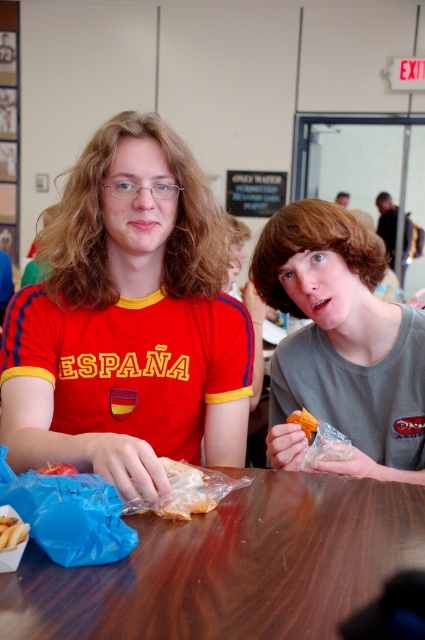
Does wooden table at center lie behind matte gray shirt at center?

No.

Can you confirm if wooden table at center is positioned to the right of matte gray shirt at center?

No, wooden table at center is not to the right of matte gray shirt at center.

Is point (105, 570) positioned before point (421, 339)?

Yes, it is.

Where is `wooden table at center`? This screenshot has height=640, width=425. wooden table at center is located at coordinates (231, 566).

Who is lower down, matte red shirt at center or golden crispy fries at table center?

golden crispy fries at table center

Who is positioned more to the right, matte red shirt at center or golden crispy fries at table center?

From the viewer's perspective, matte red shirt at center appears more on the right side.

Identify the location of matte red shirt at center. Image resolution: width=425 pixels, height=640 pixels. (129, 321).

In the scene shown: Is golden crispy fries at table center to the left of orange crumbly snack at center from the viewer's perspective?

Indeed, golden crispy fries at table center is positioned on the left side of orange crumbly snack at center.

Identify the location of golden crispy fries at table center. (11, 532).

The height and width of the screenshot is (640, 425). Identify the location of golden crispy fries at table center. (11, 532).

Identify the location of golden crispy fries at table center. (11, 532).